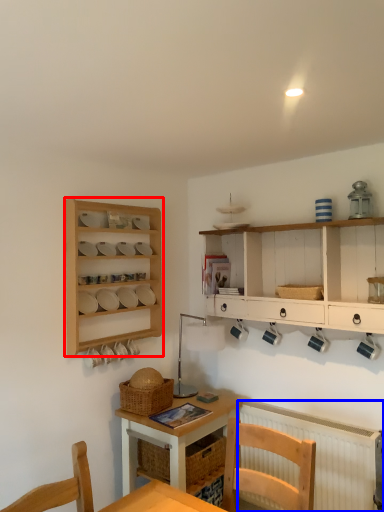
Question: Which point is further to the camera, shelf (highlighted by a red box) or radiator (highlighted by a blue box)?

Choices:
 (A) shelf
 (B) radiator

Answer: (A)